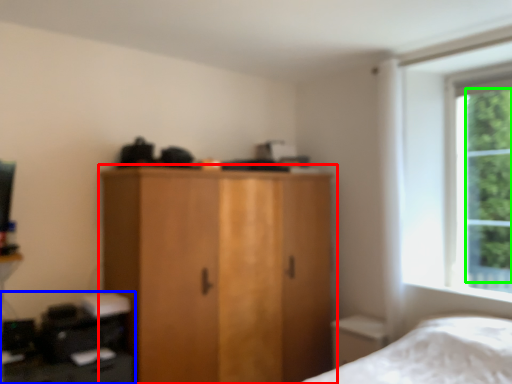
Question: Based on their relative distances, which object is farther from cupboard (highlighted by a red box)? Choose from computer desk (highlighted by a blue box) and tree (highlighted by a green box).

Choices:
 (A) computer desk
 (B) tree

Answer: (B)